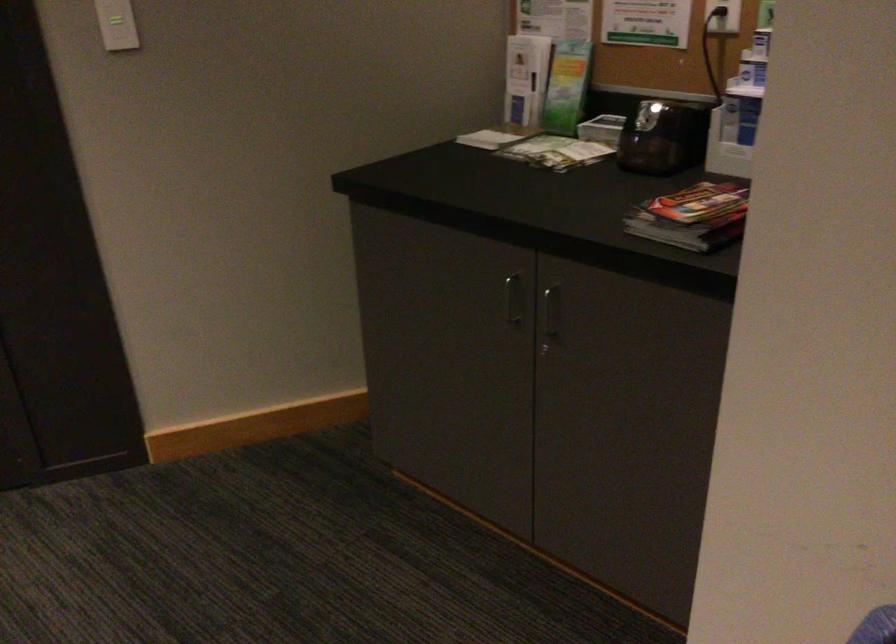
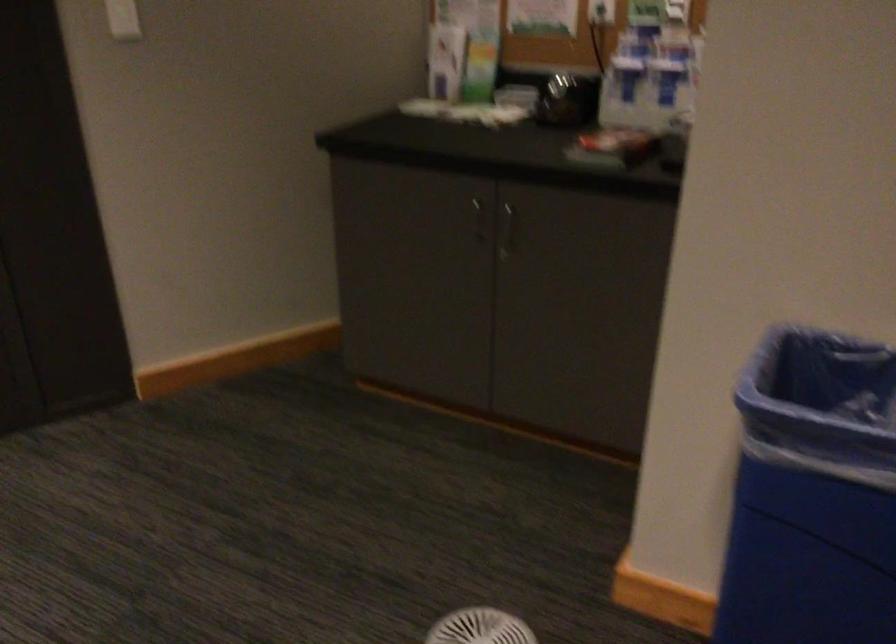
Question: The first image is from the beginning of the video and the second image is from the end. How did the camera likely rotate when shooting the video?

Choices:
 (A) Left
 (B) Right
 (C) Up
 (D) Down

Answer: (B)